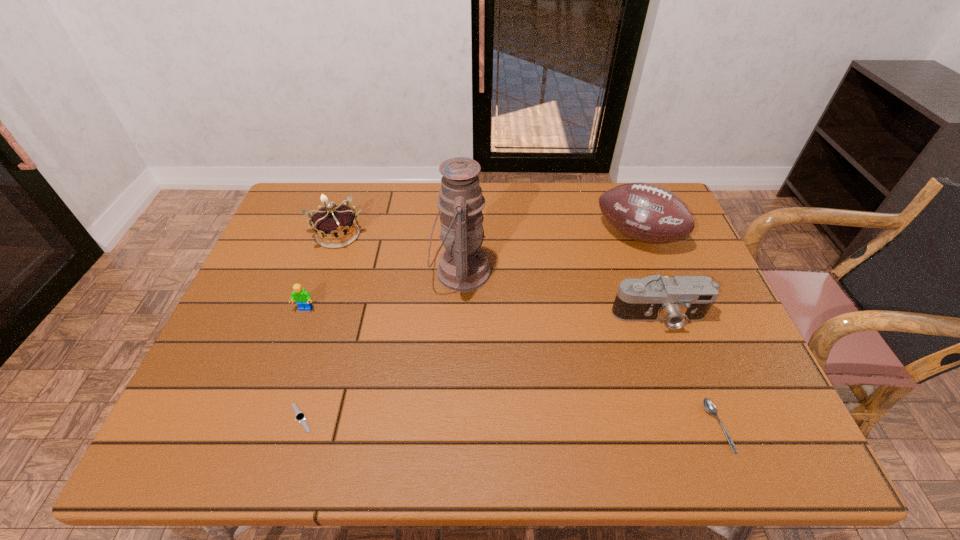
I want to click on Lego located at the left edge, so click(x=301, y=296).

At what (x,y) coordinates should I click in order to perform the action: click on football (American) situated at the right edge. Please return your answer as a coordinate pair (x, y). The width and height of the screenshot is (960, 540). Looking at the image, I should click on tap(644, 212).

Image resolution: width=960 pixels, height=540 pixels. I want to click on camera situated at the right edge, so click(x=675, y=301).

Identify the location of soupspoon positioned at the right edge. (709, 406).

Where is `object at the far left corner`? This screenshot has height=540, width=960. object at the far left corner is located at coordinates pos(335,226).

Locate an element on the screen. Image resolution: width=960 pixels, height=540 pixels. object at the far right corner is located at coordinates (644, 212).

In order to click on object that is at the near right corner in this screenshot , I will do `click(709, 406)`.

The image size is (960, 540). Identify the location of vacant space at the far edge of the desktop. (416, 201).

Image resolution: width=960 pixels, height=540 pixels. I want to click on vacant region at the near edge, so click(523, 416).

Identify the location of vacant space at the left edge of the desktop. The height and width of the screenshot is (540, 960). (290, 235).